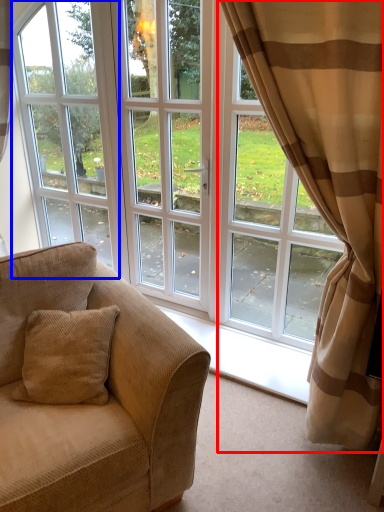
Question: Which object appears farthest to the camera in this image, curtain (highlighted by a red box) or window frame (highlighted by a blue box)?

Choices:
 (A) curtain
 (B) window frame

Answer: (B)